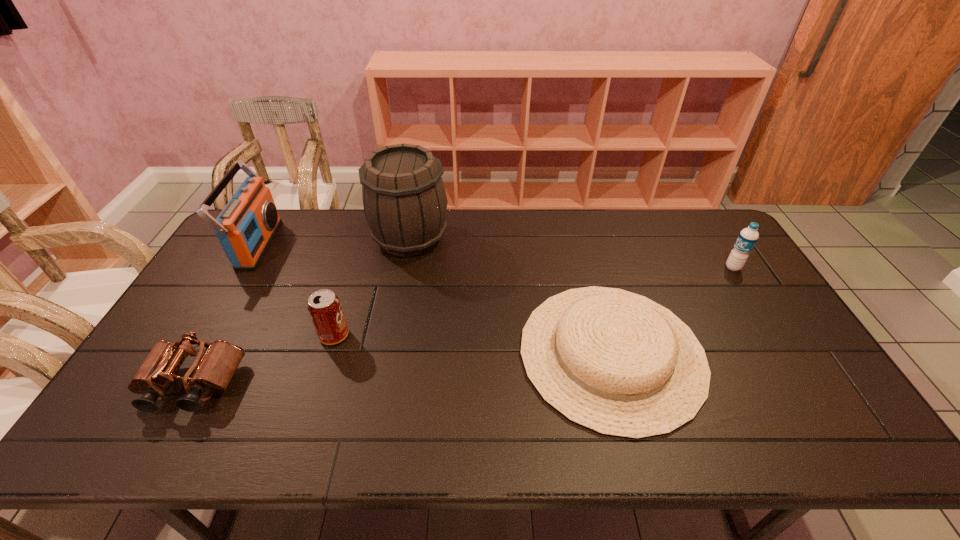
The width and height of the screenshot is (960, 540). Identify the location of the tallest object. (404, 199).

Locate an element on the screen. The height and width of the screenshot is (540, 960). the second tallest object is located at coordinates (246, 226).

This screenshot has height=540, width=960. I want to click on the rightmost object, so click(x=748, y=237).

The width and height of the screenshot is (960, 540). I want to click on water bottle, so click(748, 237).

This screenshot has height=540, width=960. Find the location of `the third shortest object`. the third shortest object is located at coordinates (324, 307).

Find the location of a particular element. the second shortest object is located at coordinates (213, 371).

I want to click on the fifth object from left to right, so click(x=618, y=363).

Identify the location of sunhat. (618, 363).

This screenshot has width=960, height=540. I want to click on free space located 0.160m on the front of the tallest object, so [x=398, y=299].

This screenshot has width=960, height=540. In order to click on vacant area situated on the front-facing side of the second tallest object in this screenshot , I will do `click(380, 245)`.